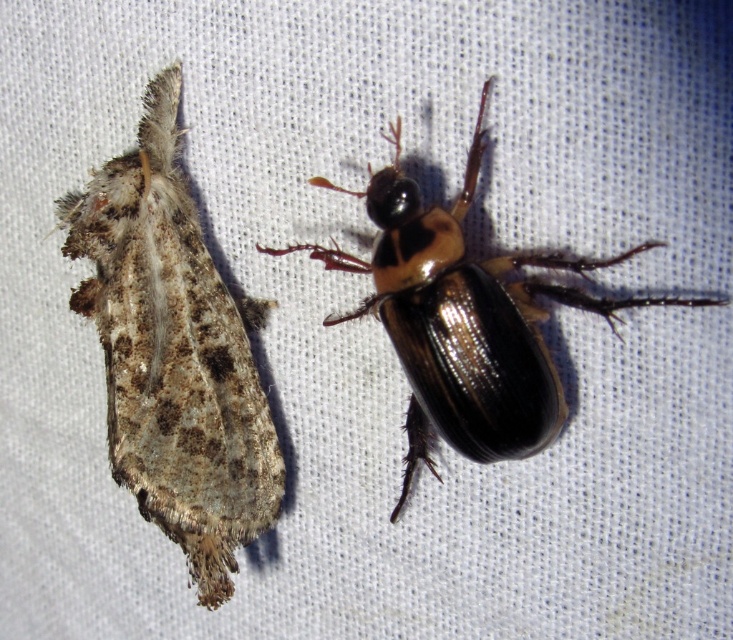
Question: Which of the following is the closest to the observer?

Choices:
 (A) (221, 371)
 (B) (537, 328)

Answer: (B)

Question: Which point is farther to the camera?

Choices:
 (A) fuzzy brown moth at left
 (B) shiny black beetle at center

Answer: (A)

Question: Observing the image, what is the correct spatial positioning of fuzzy brown moth at left in reference to shiny black beetle at center?

Choices:
 (A) above
 (B) below

Answer: (B)

Question: Observing the image, what is the correct spatial positioning of fuzzy brown moth at left in reference to shiny black beetle at center?

Choices:
 (A) left
 (B) right

Answer: (A)

Question: Is fuzzy brown moth at left below shiny black beetle at center?

Choices:
 (A) no
 (B) yes

Answer: (B)